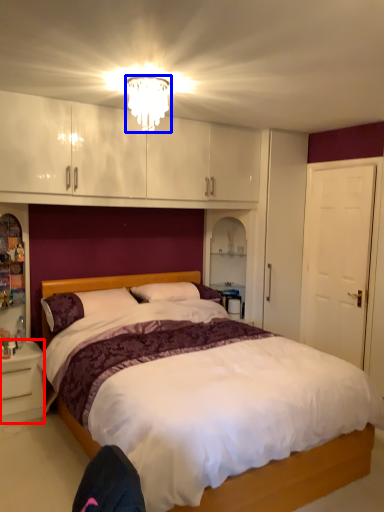
Question: Which object appears farthest to the camera in this image, nightstand (highlighted by a red box) or light fixture (highlighted by a blue box)?

Choices:
 (A) nightstand
 (B) light fixture

Answer: (A)